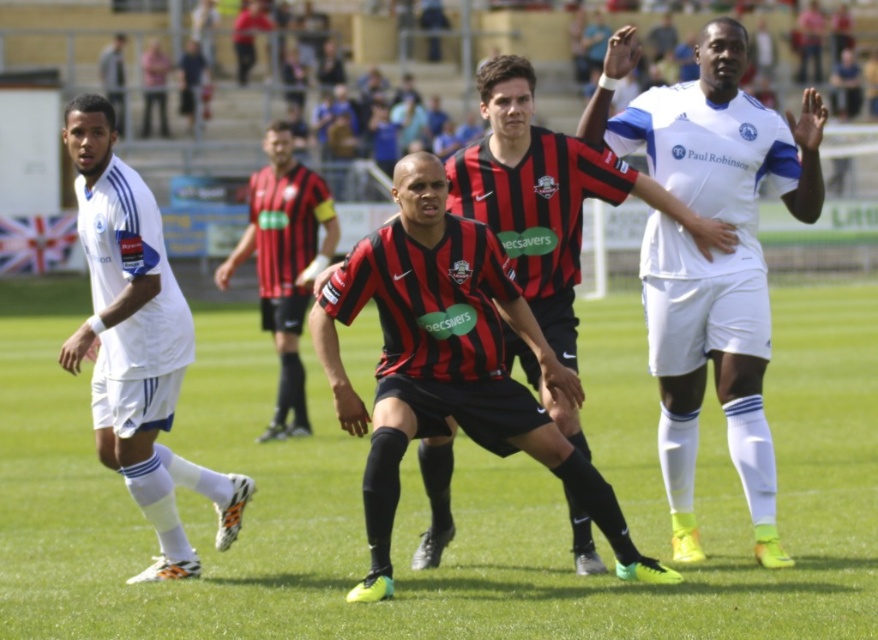
You are a soccer coach analyzing the play. You notice two points marked on the field at coordinates point [241,636] and point [114,294]. Which point is closer to the camera based on their positions?

Point [241,636] is closer to the camera than point [114,294].

You are a soccer referee observing the game. You notice the green grass football field at center and the white matte jersey at center. Which object is taller?

The white matte jersey at center is taller than the green grass football field at center.